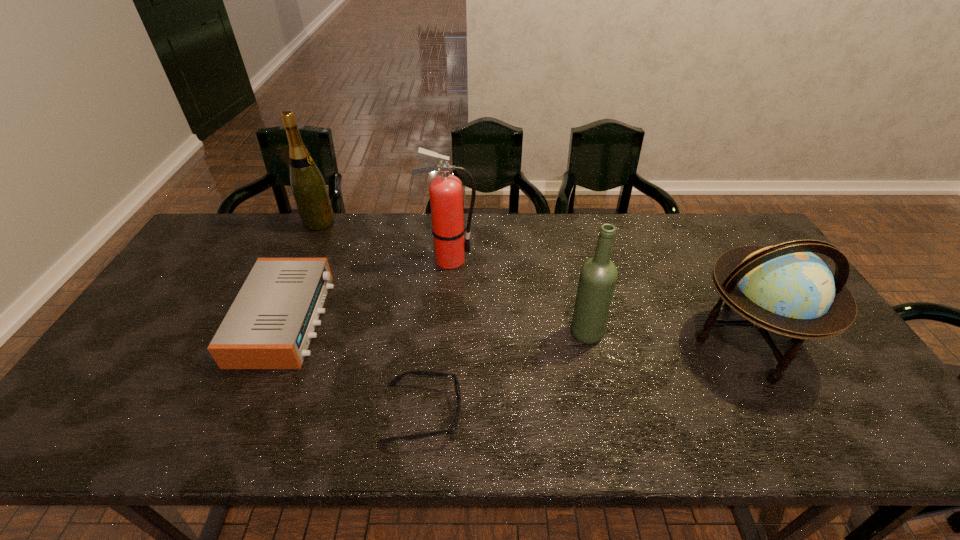
Where is `the farther wine bottle`? This screenshot has height=540, width=960. the farther wine bottle is located at coordinates (309, 189).

You are a GUI agent. You are given a task and a screenshot of the screen. Output one action in this format:
    pyautogui.click(x=<x>, y=<y>)
    Task: Click on the farthest object
    
    Given the screenshot: What is the action you would take?
    pyautogui.click(x=309, y=189)

Identify the location of the second farthest object. (446, 191).

At what (x,y) coordinates should I click in order to perform the action: click on the nearer wine bottle. Please return your answer as a coordinate pair (x, y). Looking at the image, I should click on (598, 276).

Locate an element on the screen. the second object from right to left is located at coordinates (598, 276).

I want to click on globe, so click(786, 289).

Identify the location of radio receiver. This screenshot has height=540, width=960. (270, 324).

Image resolution: width=960 pixels, height=540 pixels. Identify the location of the shortest object. (457, 388).

What are the coordinates of `free spot located 0.360m on the front-facing side of the left wine bottle` in the screenshot? It's located at (437, 222).

The width and height of the screenshot is (960, 540). What are the coordinates of `vacant space located 0.280m on the hose direction of the fire extinguisher` in the screenshot? It's located at (564, 260).